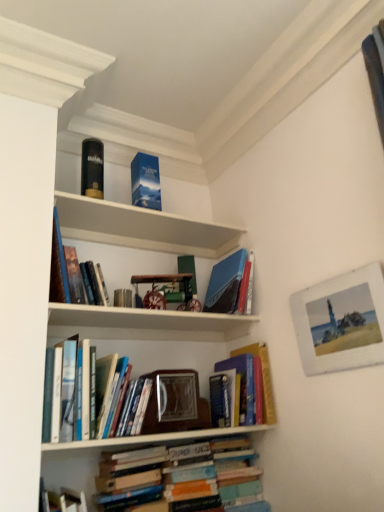
Describe the element at coordinates (72, 274) in the screenshot. I see `hardcover book at upper left, positioned as the first book in top-to-bottom order` at that location.

The image size is (384, 512). What do you see at coordinates (81, 390) in the screenshot?
I see `hardcover books at center, the third book from the bottom` at bounding box center [81, 390].

In order to face hardcover books at center, which is counted as the 2th book, starting from the top, should I rotate leftwards or rightwards?

It's best to rotate left around 16.025 degrees.

Find the location of a particular element. matte black book at upper left, which ranks as the second paperback book in right-to-left order is located at coordinates (92, 168).

What do you see at coordinates (341, 321) in the screenshot? I see `white wooden picture frame at upper right` at bounding box center [341, 321].

What do you see at coordinates (180, 477) in the screenshot?
I see `hardcover books at lower center, positioned as the first book in bottom-to-top order` at bounding box center [180, 477].

This screenshot has height=512, width=384. Describe the element at coordinates (263, 377) in the screenshot. I see `hardcover book at center, acting as the third book starting from the top` at that location.

You are a GUI agent. You are given a task and a screenshot of the screen. Output one action in this format:
    pyautogui.click(x=<x>, y=<y>)
    Task: Click on the hardcover book at upper left, which is the 4th book in bottom-to-top order
    Image resolution: width=384 pixels, height=512 pixels.
    Given the screenshot: What is the action you would take?
    pyautogui.click(x=72, y=274)

Which point is more forward, [89,231] or [109,470]?

The point [109,470] is closer to the camera.

Is blue cardboard box at upper center oriented towards hardcover books at lower center, positioned as the first book in bottom-to-top order?

No, blue cardboard box at upper center is not oriented towards hardcover books at lower center, positioned as the first book in bottom-to-top order.

Considering the relative positions of blue cardboard box at upper center and hardcover books at lower center, which is counted as the fourth book, starting from the top, in the image provided, is blue cardboard box at upper center in front of hardcover books at lower center, which is counted as the fourth book, starting from the top,?

That is False.

In terms of height, does blue cardboard box at upper center look taller or shorter compared to hardcover books at lower center, which is counted as the fourth book, starting from the top?

Clearly, blue cardboard box at upper center is shorter compared to hardcover books at lower center, which is counted as the fourth book, starting from the top.

Considering the sizes of blue matte book at upper center, which is counted as the 1th paperback book, starting from the right, and matte black book at upper left, which ranks as the second paperback book in right-to-left order, in the image, is blue matte book at upper center, which is counted as the 1th paperback book, starting from the right, wider or thinner than matte black book at upper left, which ranks as the second paperback book in right-to-left order,?

Considering their sizes, blue matte book at upper center, which is counted as the 1th paperback book, starting from the right, looks broader than matte black book at upper left, which ranks as the second paperback book in right-to-left order.

From the image's perspective, would you say blue matte book at upper center, which is counted as the 1th paperback book, starting from the right, is positioned over matte black book at upper left, which ranks as the second paperback book in right-to-left order?

No.

Between point (137, 166) and point (102, 153), which one is positioned in front?

Positioned in front is point (137, 166).

Which is more to the right, blue matte book at upper center, marked as the second paperback book in a left-to-right arrangement, or matte black book at upper left, which is counted as the first paperback book, starting from the left?

Positioned to the right is blue matte book at upper center, marked as the second paperback book in a left-to-right arrangement.

What's the angular difference between white wooden picture frame at upper right and matte black book at upper left, which is counted as the first paperback book, starting from the left,'s facing directions?

86.4 degrees.

Between white wooden picture frame at upper right and matte black book at upper left, which is counted as the first paperback book, starting from the left, which one is positioned in front?

Positioned in front is white wooden picture frame at upper right.

Based on the photo, is white wooden picture frame at upper right positioned with its back to matte black book at upper left, which ranks as the second paperback book in right-to-left order?

That's not correct — white wooden picture frame at upper right is not looking away from matte black book at upper left, which ranks as the second paperback book in right-to-left order.

Is white wooden picture frame at upper right beside matte black book at upper left, which ranks as the second paperback book in right-to-left order?

No.

What's the angular difference between matte black book at upper left, which ranks as the second paperback book in right-to-left order, and hardcover books at center, which is counted as the 2th book, starting from the top,'s facing directions?

5.39 degrees separate the facing orientations of matte black book at upper left, which ranks as the second paperback book in right-to-left order, and hardcover books at center, which is counted as the 2th book, starting from the top.

Considering the points (84, 158) and (88, 346), which point is in front, point (84, 158) or point (88, 346)?

Positioned in front is point (88, 346).

Considering the sizes of objects matte black book at upper left, which is counted as the first paperback book, starting from the left, and hardcover books at center, the third book from the bottom, in the image provided, who is bigger, matte black book at upper left, which is counted as the first paperback book, starting from the left, or hardcover books at center, the third book from the bottom,?

hardcover books at center, the third book from the bottom.

Is matte black book at upper left, which ranks as the second paperback book in right-to-left order, situated inside hardcover books at center, the third book from the bottom, or outside?

matte black book at upper left, which ranks as the second paperback book in right-to-left order, exists outside the volume of hardcover books at center, the third book from the bottom.

Is hardcover book at center, which is the second book in bottom-to-top order, located outside white wooden picture frame at upper right?

hardcover book at center, which is the second book in bottom-to-top order, is positioned outside white wooden picture frame at upper right.

Is hardcover book at center, acting as the third book starting from the top, bigger or smaller than white wooden picture frame at upper right?

Clearly, hardcover book at center, acting as the third book starting from the top, is larger in size than white wooden picture frame at upper right.

Can you confirm if hardcover book at center, which is the second book in bottom-to-top order, is wider than white wooden picture frame at upper right?

Correct, the width of hardcover book at center, which is the second book in bottom-to-top order, exceeds that of white wooden picture frame at upper right.

Could you tell me if hardcover book at center, acting as the third book starting from the top, is facing white wooden picture frame at upper right?

Yes, hardcover book at center, acting as the third book starting from the top, is turned towards white wooden picture frame at upper right.

Is hardcover books at lower center, which is counted as the fourth book, starting from the top, facing towards blue cardboard box at upper center?

No, hardcover books at lower center, which is counted as the fourth book, starting from the top, is not oriented towards blue cardboard box at upper center.

Is hardcover books at lower center, positioned as the first book in bottom-to-top order, bigger than blue cardboard box at upper center?

Yes.

Does point (118, 484) come behind point (113, 219)?

No, it is not.

Can you confirm if hardcover books at lower center, positioned as the first book in bottom-to-top order, is wider than blue cardboard box at upper center?

Yes.

How much distance is there between matte black book at upper left, which ranks as the second paperback book in right-to-left order, and hardcover books at lower center, positioned as the first book in bottom-to-top order?

The distance of matte black book at upper left, which ranks as the second paperback book in right-to-left order, from hardcover books at lower center, positioned as the first book in bottom-to-top order, is 1.22 meters.

Considering the relative sizes of matte black book at upper left, which is counted as the first paperback book, starting from the left, and hardcover books at lower center, positioned as the first book in bottom-to-top order, in the image provided, is matte black book at upper left, which is counted as the first paperback book, starting from the left, thinner than hardcover books at lower center, positioned as the first book in bottom-to-top order,?

Yes, matte black book at upper left, which is counted as the first paperback book, starting from the left, is thinner than hardcover books at lower center, positioned as the first book in bottom-to-top order.

Is matte black book at upper left, which is counted as the first paperback book, starting from the left, closer to camera compared to hardcover books at lower center, which is counted as the fourth book, starting from the top?

No, the depth of matte black book at upper left, which is counted as the first paperback book, starting from the left, is greater than that of hardcover books at lower center, which is counted as the fourth book, starting from the top.

Looking at this image, based on their positions, is matte black book at upper left, which ranks as the second paperback book in right-to-left order, located to the left or right of hardcover books at lower center, positioned as the first book in bottom-to-top order?

Clearly, matte black book at upper left, which ranks as the second paperback book in right-to-left order, is on the left of hardcover books at lower center, positioned as the first book in bottom-to-top order, in the image.

Locate an element on the screen. The image size is (384, 512). book that is the 1st one when counting rightward from the blue cardboard box at upper center is located at coordinates (180, 477).

You are a GUI agent. You are given a task and a screenshot of the screen. Output one action in this format:
    pyautogui.click(x=<x>, y=<y>)
    Task: Click on the paperback book on the left of blue matte book at upper center, marked as the second paperback book in a left-to-right arrangement
    The width and height of the screenshot is (384, 512).
    Given the screenshot: What is the action you would take?
    pyautogui.click(x=92, y=168)

Estimate the real-world distances between objects in this image. Which object is closer to matte black book at upper left, which ranks as the second paperback book in right-to-left order, white wooden picture frame at upper right or blue matte book at upper center, marked as the second paperback book in a left-to-right arrangement?

Based on the image, blue matte book at upper center, marked as the second paperback book in a left-to-right arrangement, appears to be nearer to matte black book at upper left, which ranks as the second paperback book in right-to-left order.

Based on their spatial positions, is blue matte book at upper center, marked as the second paperback book in a left-to-right arrangement, or hardcover books at center, the third book from the bottom, further from white wooden picture frame at upper right?

blue matte book at upper center, marked as the second paperback book in a left-to-right arrangement, lies further to white wooden picture frame at upper right than the other object.

Based on their spatial positions, is hardcover books at lower center, positioned as the first book in bottom-to-top order, or blue cardboard box at upper center closer to hardcover book at upper left, positioned as the first book in top-to-bottom order?

Among the two, blue cardboard box at upper center is located nearer to hardcover book at upper left, positioned as the first book in top-to-bottom order.

Which object lies nearer to the anchor point hardcover books at lower center, positioned as the first book in bottom-to-top order, blue cardboard box at upper center or hardcover books at center, the third book from the bottom?

The object closer to hardcover books at lower center, positioned as the first book in bottom-to-top order, is hardcover books at center, the third book from the bottom.

From the image, which object appears to be farther from hardcover book at upper left, positioned as the first book in top-to-bottom order, white wooden picture frame at upper right or matte black book at upper left, which is counted as the first paperback book, starting from the left?

white wooden picture frame at upper right is positioned further to the anchor hardcover book at upper left, positioned as the first book in top-to-bottom order.

Which object lies further to the anchor point matte black book at upper left, which ranks as the second paperback book in right-to-left order, hardcover book at center, which is the second book in bottom-to-top order, or hardcover book at upper left, positioned as the first book in top-to-bottom order?

hardcover book at center, which is the second book in bottom-to-top order.

Considering their positions, is hardcover books at center, which is counted as the 2th book, starting from the top, positioned closer to blue matte book at upper center, marked as the second paperback book in a left-to-right arrangement, than matte black book at upper left, which is counted as the first paperback book, starting from the left?

matte black book at upper left, which is counted as the first paperback book, starting from the left, is closer to blue matte book at upper center, marked as the second paperback book in a left-to-right arrangement.

Estimate the real-world distances between objects in this image. Which object is closer to blue matte book at upper center, which is counted as the 1th paperback book, starting from the right, hardcover books at lower center, positioned as the first book in bottom-to-top order, or hardcover books at center, the third book from the bottom?

Based on the image, hardcover books at center, the third book from the bottom, appears to be nearer to blue matte book at upper center, which is counted as the 1th paperback book, starting from the right.

I want to click on shelf between hardcover books at center, the third book from the bottom, and white wooden picture frame at upper right from left to right, so click(x=141, y=227).

The height and width of the screenshot is (512, 384). I want to click on paperback book between matte black book at upper left, which is counted as the first paperback book, starting from the left, and hardcover books at center, the third book from the bottom, from top to bottom, so click(x=145, y=181).

Where is `paperback book between matte black book at upper left, which is counted as the first paperback book, starting from the left, and white wooden picture frame at upper right`? The width and height of the screenshot is (384, 512). paperback book between matte black book at upper left, which is counted as the first paperback book, starting from the left, and white wooden picture frame at upper right is located at coordinates (145, 181).

The width and height of the screenshot is (384, 512). I want to click on shelf between matte black book at upper left, which ranks as the second paperback book in right-to-left order, and hardcover book at center, acting as the third book starting from the top, in the vertical direction, so click(x=141, y=227).